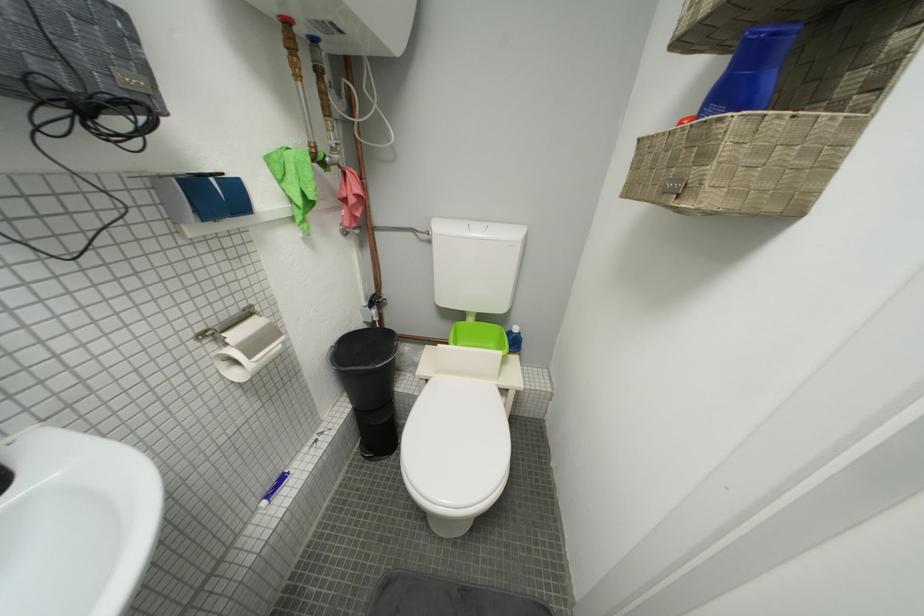
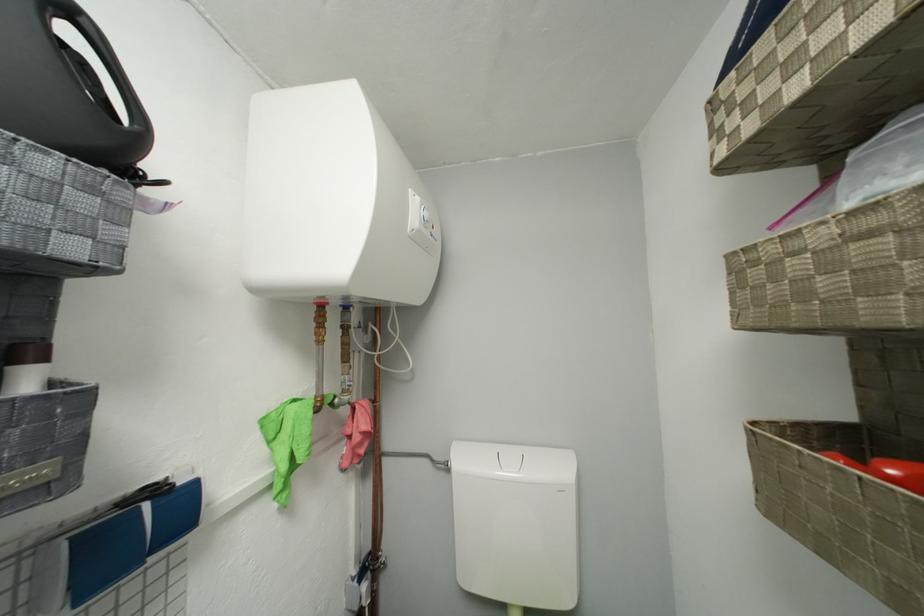
In the second image, find the point that corresponds to (x=354, y=197) in the first image.

(358, 435)